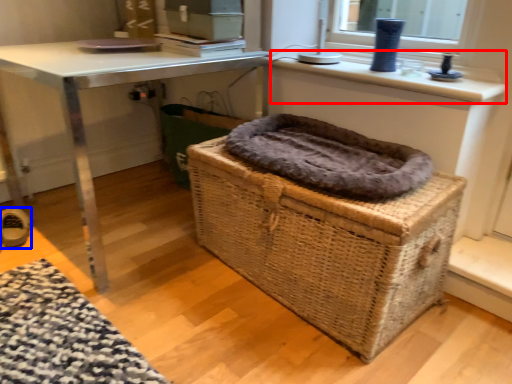
Question: Among these objects, which one is nearest to the camera, counter top (highlighted by a red box) or shoe (highlighted by a blue box)?

Choices:
 (A) counter top
 (B) shoe

Answer: (A)